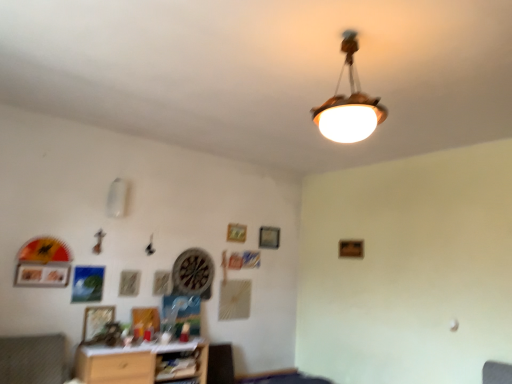
You are a GUI agent. You are given a task and a screenshot of the screen. Output one action in this format:
    pyautogui.click(x=<x>, y=<y>)
    Task: Click on the wooden picture frame at upper center, marked as the 1th picture frame in a right-to-left arrangement
    The image size is (512, 384).
    Given the screenshot: What is the action you would take?
    point(269,237)

Image resolution: width=512 pixels, height=384 pixels. What do you see at coordinates (177, 365) in the screenshot? I see `wooden shelf at lower center` at bounding box center [177, 365].

What do you see at coordinates (32, 359) in the screenshot? Image resolution: width=512 pixels, height=384 pixels. I see `textured fabric swivel chair at lower left` at bounding box center [32, 359].

Where is `wooden dartboard at center`? The width and height of the screenshot is (512, 384). wooden dartboard at center is located at coordinates (193, 273).

Is point (266, 239) closer or farther from the camera than point (84, 332)?

Point (266, 239) is positioned farther from the camera compared to point (84, 332).

Which of these two, wooden picture frame at upper center, arranged as the first picture frame when viewed from the back, or wooden picture frame at lower left, positioned as the second picture frame in back-to-front order, is wider?

wooden picture frame at upper center, arranged as the first picture frame when viewed from the back, is wider.

Who is taller, wooden picture frame at upper center, acting as the first picture frame starting from the top, or wooden picture frame at lower left, positioned as the second picture frame in back-to-front order?

wooden picture frame at lower left, positioned as the second picture frame in back-to-front order.

From a real-world perspective, count 2nd picture frames upward from the wooden picture frame at lower left, positioned as the second picture frame in back-to-front order, and point to it. Please provide its 2D coordinates.

[(269, 237)]

Is wooden ceiling light at upper center located outside wooden table at lower center?

Yes, wooden ceiling light at upper center is not within wooden table at lower center.

Considering the sizes of wooden ceiling light at upper center and wooden table at lower center in the image, is wooden ceiling light at upper center wider or thinner than wooden table at lower center?

Considering their sizes, wooden ceiling light at upper center looks slimmer than wooden table at lower center.

How far apart are wooden ceiling light at upper center and wooden table at lower center?

wooden ceiling light at upper center and wooden table at lower center are 8.39 feet apart from each other.

Is wooden ceiling light at upper center positioned before wooden table at lower center?

Yes, it is.

Find the location of a particular element. This screenshot has height=384, width=512. swivel chair in front of the wooden shelf at lower center is located at coordinates (x=32, y=359).

Does wooden shelf at lower center have a smaller size compared to textured fabric swivel chair at lower left?

Correct, wooden shelf at lower center occupies less space than textured fabric swivel chair at lower left.

Between wooden shelf at lower center and textured fabric swivel chair at lower left, which one appears on the left side from the viewer's perspective?

Positioned to the left is textured fabric swivel chair at lower left.

I want to click on shelf lying above the wooden table at lower center (from the image's perspective), so [x=177, y=365].

Are wooden shelf at lower center and wooden table at lower center far apart?

No, wooden shelf at lower center is not far away from wooden table at lower center.

Considering the sizes of objects wooden shelf at lower center and wooden table at lower center in the image provided, who is thinner, wooden shelf at lower center or wooden table at lower center?

With smaller width is wooden shelf at lower center.

Based on their sizes in the image, would you say wooden shelf at lower center is bigger or smaller than wooden table at lower center?

In the image, wooden shelf at lower center appears to be smaller than wooden table at lower center.

Is wooden ceiling light at upper center far away from wooden shelf at lower center?

→ wooden ceiling light at upper center is positioned a significant distance from wooden shelf at lower center.

Is point (372, 119) closer to viewer compared to point (178, 354)?

That is True.

Between wooden ceiling light at upper center and wooden shelf at lower center, which one has larger size?

Bigger between the two is wooden ceiling light at upper center.

I want to click on lamp on the right of wooden shelf at lower center, so click(x=349, y=104).

Does wooden dartboard at center have a larger size compared to wooden shelf at lower center?

Incorrect, wooden dartboard at center is not larger than wooden shelf at lower center.

From a real-world perspective, who is located higher, wooden dartboard at center or wooden shelf at lower center?

In real-world perspective, wooden dartboard at center is above.

From the image's perspective, who appears lower, wooden dartboard at center or wooden shelf at lower center?

wooden shelf at lower center is shown below in the image.

Could you tell me if wooden dartboard at center is facing wooden shelf at lower center?

No, wooden dartboard at center does not turn towards wooden shelf at lower center.

Does point (175, 289) lie in front of point (147, 346)?

No, (175, 289) is further to viewer.

Consider the image. Which is more to the right, wooden dartboard at center or wooden table at lower center?

Positioned to the right is wooden dartboard at center.

The height and width of the screenshot is (384, 512). Identify the location of clock located on the right of wooden table at lower center. (193, 273).

There is a wooden picture frame at lower left, which is the second picture frame in right-to-left order. Identify the location of the 2nd picture frame above it (from a real-world perspective). Image resolution: width=512 pixels, height=384 pixels. (269, 237).

Locate an element on the screen. The height and width of the screenshot is (384, 512). table lying below the wooden ceiling light at upper center (from the image's perspective) is located at coordinates (133, 362).

When comparing their distances from wooden ceiling light at upper center, does wooden picture frame at upper center, arranged as the first picture frame when viewed from the back, or textured fabric swivel chair at lower left seem closer?

textured fabric swivel chair at lower left lies closer to wooden ceiling light at upper center than the other object.

Estimate the real-world distances between objects in this image. Which object is closer to textured fabric swivel chair at lower left, wooden picture frame at upper center, arranged as the first picture frame when viewed from the back, or wooden ceiling light at upper center?

The object closer to textured fabric swivel chair at lower left is wooden picture frame at upper center, arranged as the first picture frame when viewed from the back.

Based on their spatial positions, is wooden ceiling light at upper center or wooden picture frame at lower left, the third picture frame when ordered from top to bottom, further from wooden shelf at lower center?

wooden ceiling light at upper center is further to wooden shelf at lower center.

From the image, which object appears to be nearer to wooden dartboard at center, wooden picture frame at lower left, which is the second picture frame in right-to-left order, or wooden picture frame at upper center, arranged as the first picture frame when viewed from the back?

wooden picture frame at lower left, which is the second picture frame in right-to-left order, is positioned closer to the anchor wooden dartboard at center.

Estimate the real-world distances between objects in this image. Which object is closer to wooden ceiling light at upper center, wooden table at lower center or wooden picture frame at upper center, acting as the first picture frame starting from the top?

wooden table at lower center is positioned closer to the anchor wooden ceiling light at upper center.

From the image, which object appears to be farther from textured fabric swivel chair at lower left, wooden dartboard at center or wooden table at lower center?

wooden dartboard at center.

Considering their positions, is textured fabric swivel chair at lower left positioned closer to wooden picture frame at lower left, which appears as the 2th picture frame when viewed from the left, than wooden ceiling light at upper center?

textured fabric swivel chair at lower left is closer to wooden picture frame at lower left, which appears as the 2th picture frame when viewed from the left.

Estimate the real-world distances between objects in this image. Which object is further from textured fabric swivel chair at lower left, wooden ceiling light at upper center or wooden table at lower center?

wooden ceiling light at upper center.

Find the location of `clock between wooden ceiling light at upper center and wooden picture frame at upper center, marked as the 3th picture frame in a front-to-back arrangement, along the z-axis`. clock between wooden ceiling light at upper center and wooden picture frame at upper center, marked as the 3th picture frame in a front-to-back arrangement, along the z-axis is located at coordinates (193, 273).

Locate an element on the screen. The height and width of the screenshot is (384, 512). table situated between matte silver picture frame at lower left, positioned as the 1th picture frame in left-to-right order, and wooden picture frame at upper center, marked as the 1th picture frame in a right-to-left arrangement, from left to right is located at coordinates (133, 362).

Identify the location of picture frame between matte silver picture frame at lower left, positioned as the 1th picture frame in left-to-right order, and wooden shelf at lower center from left to right. (96, 320).

Image resolution: width=512 pixels, height=384 pixels. Identify the location of table between textured fabric swivel chair at lower left and wooden dartboard at center from front to back. coord(133,362).